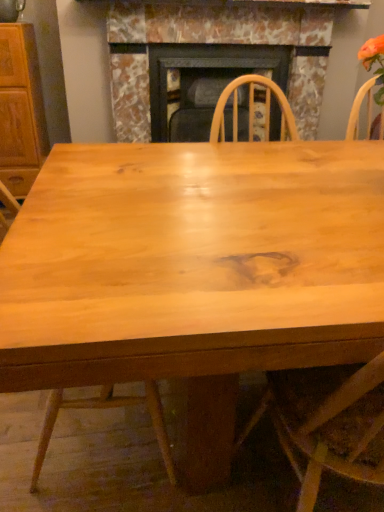
This screenshot has width=384, height=512. What do you see at coordinates (105, 408) in the screenshot?
I see `natural wood chair at center` at bounding box center [105, 408].

In order to click on marble fireplace at center in this screenshot , I will do `click(243, 36)`.

What is the approximate height of wooden cabinet at left?

3.61 feet.

Looking at this image, what is the approximate width of wooden cabinet at left?

It is 47.67 centimeters.

You are a GUI agent. You are given a task and a screenshot of the screen. Output one action in this format:
    pyautogui.click(x=<x>, y=<y>)
    Task: Click on the natural wood chair at center
    This screenshot has width=384, height=512.
    Given the screenshot: What is the action you would take?
    pyautogui.click(x=105, y=408)

Is wooden cabinet at left in front of natural wood chair at center?

No, wooden cabinet at left is further to the viewer.

In the image, is wooden cabinet at left on the left side or the right side of natural wood chair at center?

Based on their positions, wooden cabinet at left is located to the left of natural wood chair at center.

From a real-world perspective, between wooden cabinet at left and natural wood chair at center, who is vertically higher?

wooden cabinet at left.

What's the angular difference between wooden cabinet at left and natural wood chair at center's facing directions?

The facing directions of wooden cabinet at left and natural wood chair at center are 87.5 degrees apart.

Is marble fireplace at center completely or partially inside natural wood chair at center?

No, marble fireplace at center is not surrounded by natural wood chair at center.

Is natural wood chair at center taller than marble fireplace at center?

Yes.

Is natural wood chair at center facing towards marble fireplace at center?

No, natural wood chair at center is not turned towards marble fireplace at center.

Locate an element on the screen. fireplace on the right side of natural wood chair at center is located at coordinates (243, 36).

From a real-world perspective, between marble fireplace at center and natural wood chair at center, who is vertically higher?

marble fireplace at center, from a real-world perspective.

Which object is more forward, marble fireplace at center or natural wood chair at center?

Positioned in front is natural wood chair at center.

Does marble fireplace at center turn towards natural wood chair at center?

Yes.

From the image's perspective, which object appears higher, natural wood chair at center or wooden cabinet at left?

wooden cabinet at left is shown above in the image.

At what (x,y) coordinates should I click in order to perform the action: click on cabinetry on the left of natural wood chair at center. Please return your answer as a coordinate pair (x, y). The image size is (384, 512). Looking at the image, I should click on (20, 109).

Considering the relative sizes of natural wood chair at center and wooden cabinet at left in the image provided, is natural wood chair at center shorter than wooden cabinet at left?

Yes.

From a real-world perspective, which is physically below, natural wood chair at center or wooden cabinet at left?

In real-world perspective, natural wood chair at center is lower.

Is marble fireplace at center bigger than wooden cabinet at left?

Answer: Yes.

Which object is more forward, marble fireplace at center or wooden cabinet at left?

wooden cabinet at left is more forward.

Are marble fireplace at center and wooden cabinet at left located far from each other?

No, marble fireplace at center is not far from wooden cabinet at left.

Is marble fireplace at center turned away from wooden cabinet at left?

marble fireplace at center is not turned away from wooden cabinet at left.

From the image's perspective, which object appears higher, wooden cabinet at left or marble fireplace at center?

From the image's view, marble fireplace at center is above.

Between wooden cabinet at left and marble fireplace at center, which one is positioned in front?

wooden cabinet at left is in front.

Is wooden cabinet at left beside marble fireplace at center?

No, wooden cabinet at left is not in contact with marble fireplace at center.

Locate an element on the screen. Image resolution: width=384 pixels, height=512 pixels. fireplace on the right of wooden cabinet at left is located at coordinates (243, 36).

This screenshot has width=384, height=512. In the image, there is a wooden cabinet at left. Identify the location of chair below it (from a real-world perspective). (105, 408).

Where is `fireplace above the natural wood chair at center (from the image's perspective)`? Image resolution: width=384 pixels, height=512 pixels. fireplace above the natural wood chair at center (from the image's perspective) is located at coordinates (243, 36).

Looking at the image, which one is located further to natural wood chair at center, marble fireplace at center or wooden cabinet at left?

Among the two, marble fireplace at center is located further to natural wood chair at center.

Which object lies nearer to the anchor point wooden cabinet at left, marble fireplace at center or natural wood chair at center?

marble fireplace at center is positioned closer to the anchor wooden cabinet at left.

When comparing their distances from natural wood chair at center, does wooden cabinet at left or marble fireplace at center seem closer?

The object closer to natural wood chair at center is wooden cabinet at left.

Estimate the real-world distances between objects in this image. Which object is further from marble fireplace at center, wooden cabinet at left or natural wood chair at center?

natural wood chair at center is further to marble fireplace at center.

Which object lies nearer to the anchor point wooden cabinet at left, natural wood chair at center or marble fireplace at center?

marble fireplace at center.

Estimate the real-world distances between objects in this image. Which object is closer to marble fireplace at center, natural wood chair at center or wooden cabinet at left?

The object closer to marble fireplace at center is wooden cabinet at left.

Where is `cabinetry located between natural wood chair at center and marble fireplace at center in the depth direction`? cabinetry located between natural wood chair at center and marble fireplace at center in the depth direction is located at coordinates (20, 109).